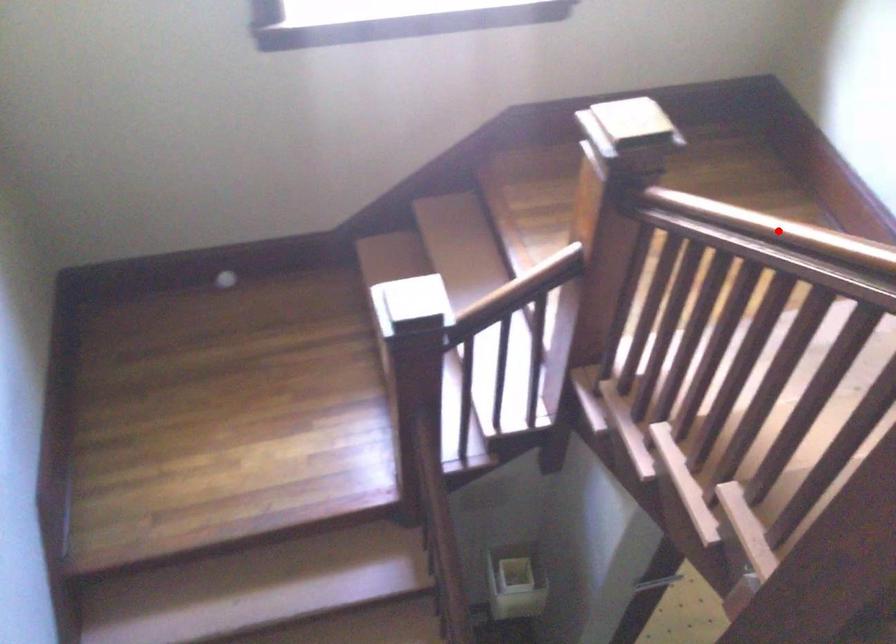
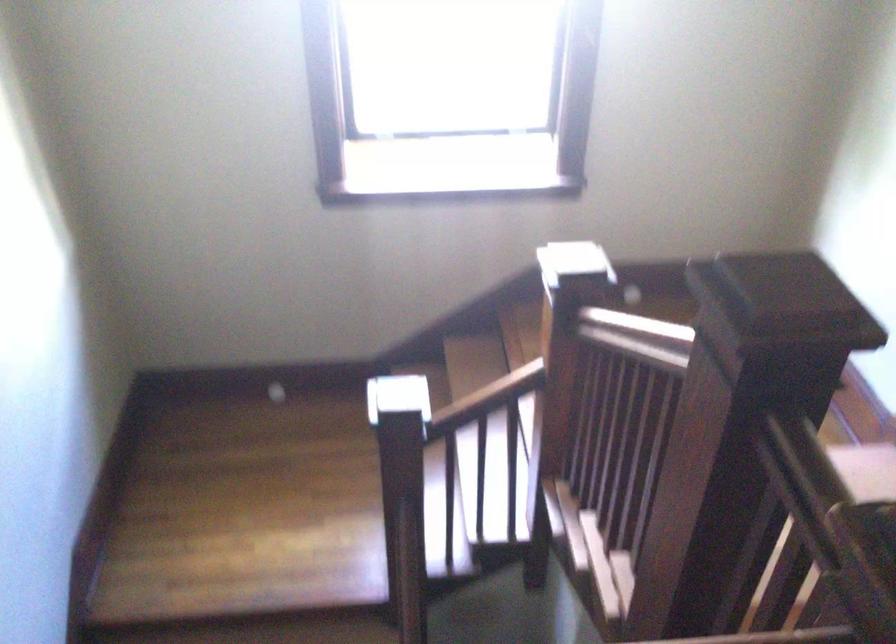
Question: I am providing you with two images of the same scene from different viewpoints. A red point is marked on the first image. Is the red point's position out of view in image 2?

Choices:
 (A) Yes
 (B) No

Answer: (A)